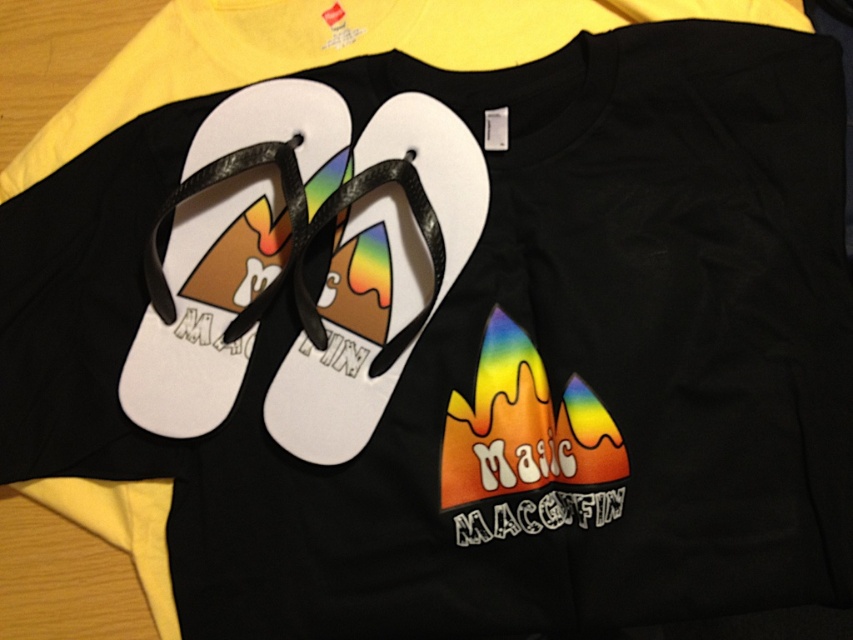
Which is in front, point (270, 106) or point (430, 253)?

Point (430, 253)

Between white matte sandal at center and white rubber sandal at center, which one appears on the left side from the viewer's perspective?

white matte sandal at center is more to the left.

Who is more distant from viewer, (186, 218) or (296, 349)?

Point (186, 218)

The height and width of the screenshot is (640, 853). I want to click on white matte sandal at center, so click(x=229, y=250).